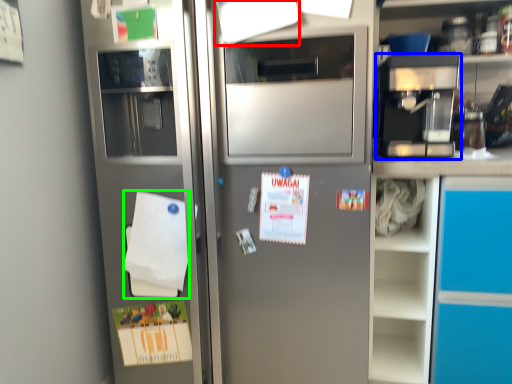
Question: Which is nearer to the paper (highlighted by a red box)? coffee machine (highlighted by a blue box) or notepad (highlighted by a green box).

Choices:
 (A) coffee machine
 (B) notepad

Answer: (A)